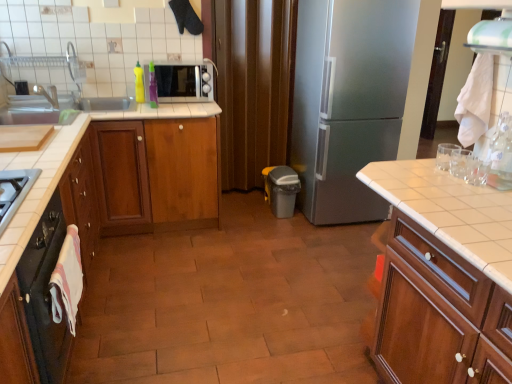
Question: Should I look upward or downward to see white tile countertop at right?

Choices:
 (A) up
 (B) down

Answer: (B)

Question: Can we say wooden cabinet at center, the 2th cabinetry when ordered from left to right, lies outside green plastic bottle at upper left, the 2th bottle when ordered from front to back?

Choices:
 (A) yes
 (B) no

Answer: (A)

Question: Is wooden cabinet at center, the third cabinetry in the right-to-left sequence, wider than green plastic bottle at upper left, positioned as the second bottle in left-to-right order?

Choices:
 (A) no
 (B) yes

Answer: (B)

Question: From the image's perspective, is wooden cabinet at center, the third cabinetry in the right-to-left sequence, over green plastic bottle at upper left, which is the 2th bottle in back-to-front order?

Choices:
 (A) yes
 (B) no

Answer: (B)

Question: From a real-world perspective, is wooden cabinet at center, the third cabinetry in the right-to-left sequence, located beneath green plastic bottle at upper left, which is the 2th bottle in back-to-front order?

Choices:
 (A) yes
 (B) no

Answer: (A)

Question: From a real-world perspective, is wooden cabinet at center, the 2th cabinetry when ordered from left to right, over green plastic bottle at upper left, which is counted as the 2th bottle, starting from the top?

Choices:
 (A) no
 (B) yes

Answer: (A)

Question: Considering the relative sizes of wooden cabinet at center, the third cabinetry in the right-to-left sequence, and green plastic bottle at upper left, which ranks as the second bottle in bottom-to-top order, in the image provided, is wooden cabinet at center, the third cabinetry in the right-to-left sequence, shorter than green plastic bottle at upper left, which ranks as the second bottle in bottom-to-top order,?

Choices:
 (A) yes
 (B) no

Answer: (B)

Question: Does brown matte curtain at center appear on the right side of satin silver gas stove at lower left?

Choices:
 (A) no
 (B) yes

Answer: (B)

Question: Can you see brown matte curtain at center touching satin silver gas stove at lower left?

Choices:
 (A) no
 (B) yes

Answer: (A)

Question: Considering the relative sizes of brown matte curtain at center and satin silver gas stove at lower left in the image provided, is brown matte curtain at center smaller than satin silver gas stove at lower left?

Choices:
 (A) yes
 (B) no

Answer: (B)

Question: Does brown matte curtain at center have a lesser height compared to satin silver gas stove at lower left?

Choices:
 (A) no
 (B) yes

Answer: (A)

Question: Is satin silver gas stove at lower left surrounded by brown matte curtain at center?

Choices:
 (A) no
 (B) yes

Answer: (A)

Question: Is brown matte curtain at center far away from satin silver gas stove at lower left?

Choices:
 (A) yes
 (B) no

Answer: (A)

Question: Is wooden cabinet at center, the third cabinetry viewed from the left, at the left side of clear plastic bottle at right, the first bottle when ordered from bottom to top?

Choices:
 (A) yes
 (B) no

Answer: (A)